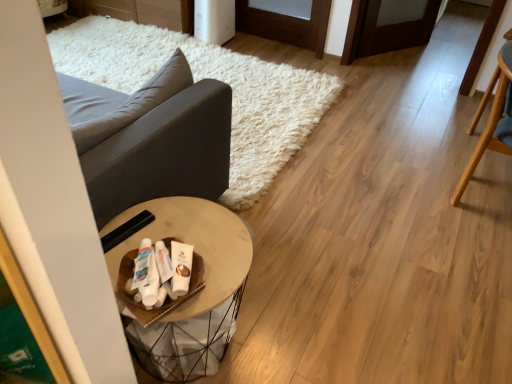
The width and height of the screenshot is (512, 384). I want to click on vacant area that is situated to the right of white matte toothpaste tube at center, which is counted as the 1th toiletry, starting from the left, so click(x=215, y=269).